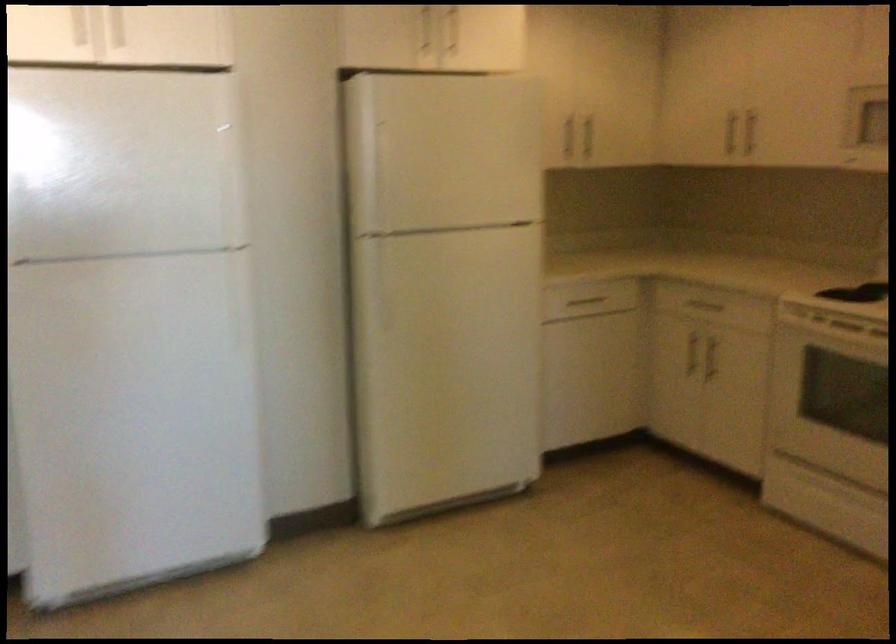
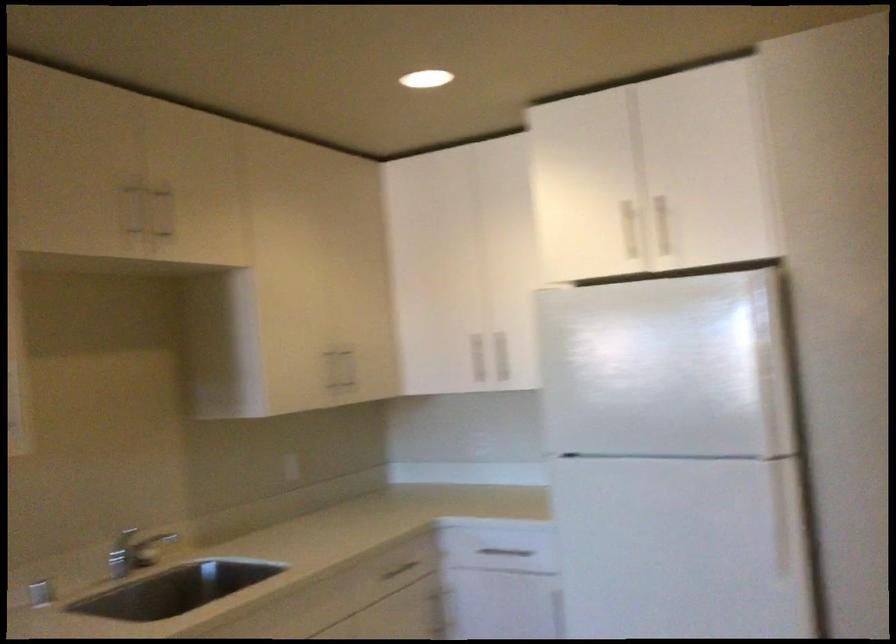
Question: Based on the continuous images, in which direction is the camera rotating? Reply with the corresponding letter.

Choices:
 (A) Left
 (B) Right
 (C) Up
 (D) Down

Answer: (A)